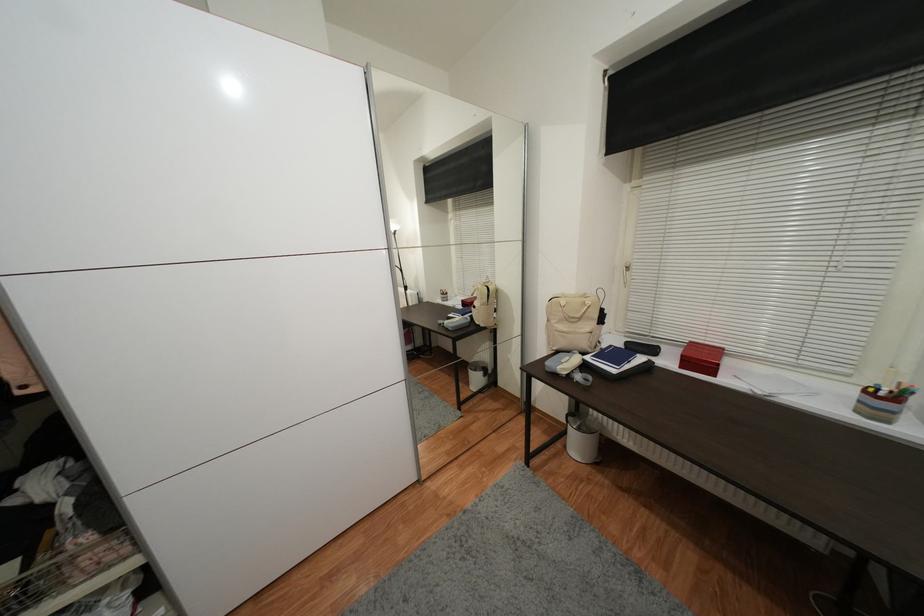
Where would you lift the beige backpack handle? Please return your answer as a coordinate pair (x, y).

(574, 308)